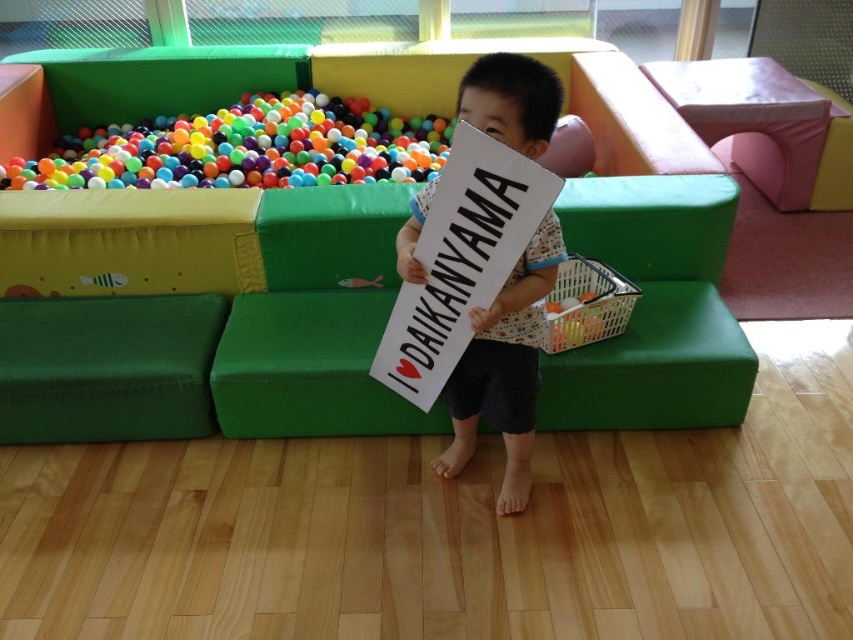
Question: Estimate the real-world distances between objects in this image. Which object is closer to the green fabric couch at center?

Choices:
 (A) multicolored plastic balls at upper left
 (B) white cardboard sign at center

Answer: (B)

Question: Does multicolored plastic balls at upper left come in front of white cardboard sign at center?

Choices:
 (A) yes
 (B) no

Answer: (B)

Question: Among these objects, which one is farthest from the camera?

Choices:
 (A) white cardboard sign at center
 (B) green fabric couch at center

Answer: (B)

Question: Is green fabric couch at center in front of white cardboard sign at center?

Choices:
 (A) no
 (B) yes

Answer: (A)

Question: Based on their relative distances, which object is farther from the green fabric couch at center?

Choices:
 (A) white cardboard sign at center
 (B) multicolored plastic balls at upper left

Answer: (B)

Question: From the image, what is the correct spatial relationship of green fabric couch at center in relation to multicolored plastic balls at upper left?

Choices:
 (A) left
 (B) right

Answer: (B)